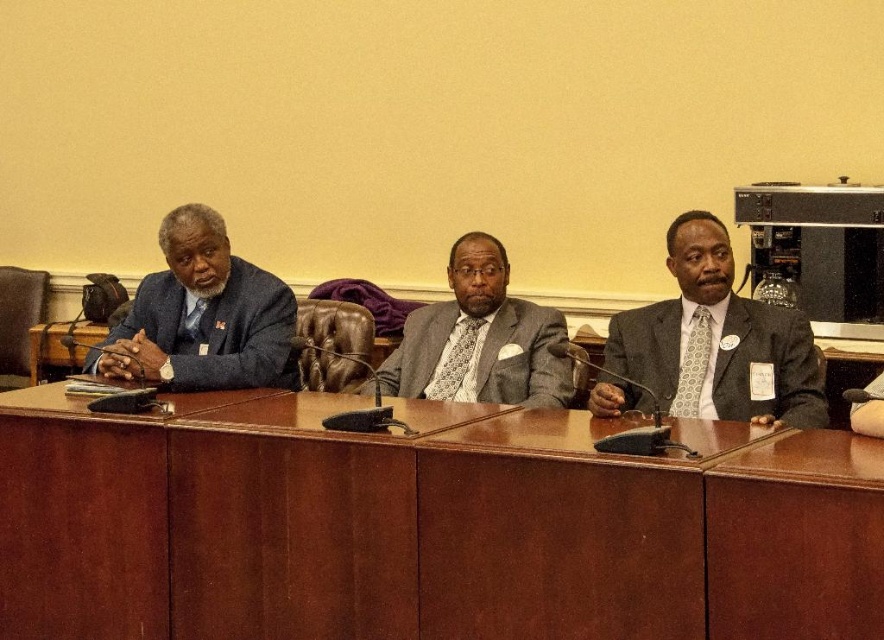
Does matte gray suit at right have a greater width compared to matte black suit at left?

In fact, matte gray suit at right might be narrower than matte black suit at left.

Is matte gray suit at right positioned before matte black suit at left?

Yes, it is.

Is point (802, 410) closer to viewer compared to point (192, 328)?

Yes, it is.

Find the location of a particular element. The width and height of the screenshot is (884, 640). matte gray suit at right is located at coordinates (761, 364).

Between brown wood table at center and matte gray suit at right, which one is positioned higher?

Positioned higher is matte gray suit at right.

In the scene shown: Is brown wood table at center wider than matte gray suit at right?

Yes, brown wood table at center is wider than matte gray suit at right.

Which is in front, point (700, 584) or point (713, 381)?

Point (700, 584) is more forward.

I want to click on brown wood table at center, so click(425, 528).

Does matte black suit at left appear on the left side of matte gray suit at center?

Yes, matte black suit at left is to the left of matte gray suit at center.

Who is positioned more to the left, matte black suit at left or matte gray suit at center?

matte black suit at left is more to the left.

Is point (258, 381) farther from viewer compared to point (519, 356)?

That is False.

The height and width of the screenshot is (640, 884). Find the location of `matte black suit at left`. matte black suit at left is located at coordinates (217, 330).